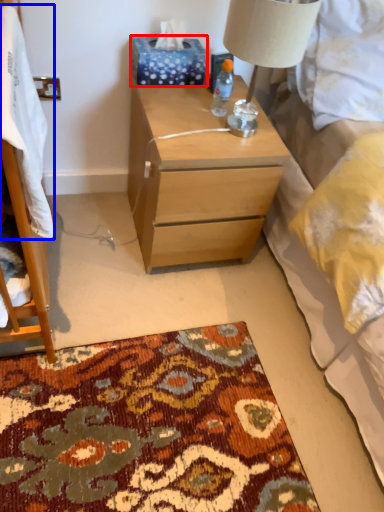
Question: Which object appears farthest to the camera in this image, tissue paper (highlighted by a red box) or blanket (highlighted by a blue box)?

Choices:
 (A) tissue paper
 (B) blanket

Answer: (A)